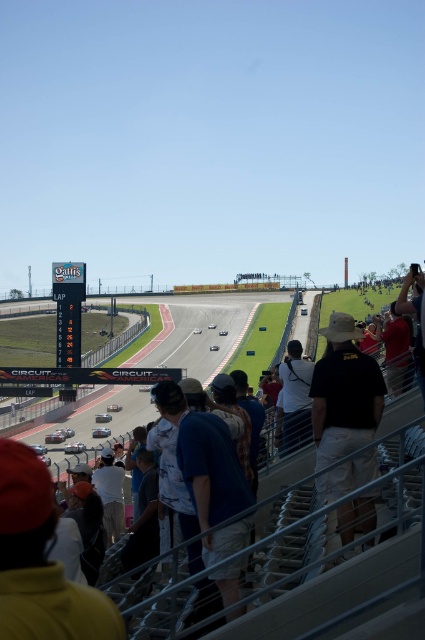
Who is positioned more to the left, blue cotton shirt at center or white fabric camera at center?

From the viewer's perspective, blue cotton shirt at center appears more on the left side.

What are the coordinates of `blue cotton shirt at center` in the screenshot? It's located at (204, 458).

Is black cotton hat at center below white cotton shirt at lower left?

No, black cotton hat at center is not below white cotton shirt at lower left.

The width and height of the screenshot is (425, 640). Find the location of `black cotton hat at center`. black cotton hat at center is located at coordinates (343, 394).

Is point (285, 385) more distant than point (391, 307)?

No.

Measure the distance between white fabric camera at center and red shirt at right.

17.02 meters

Describe the element at coordinates (295, 397) in the screenshot. I see `white fabric camera at center` at that location.

The width and height of the screenshot is (425, 640). What are the coordinates of `white fabric camera at center` in the screenshot? It's located at (295, 397).